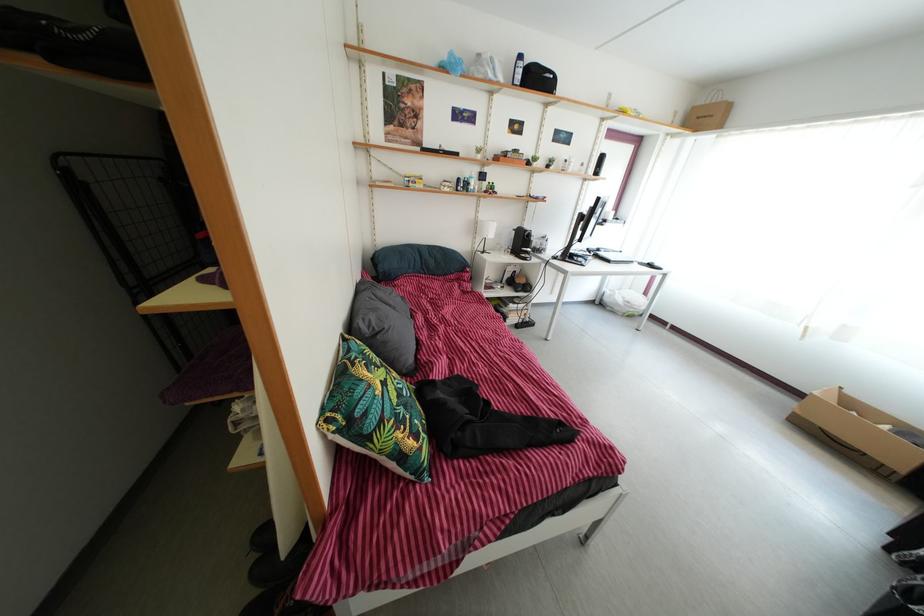
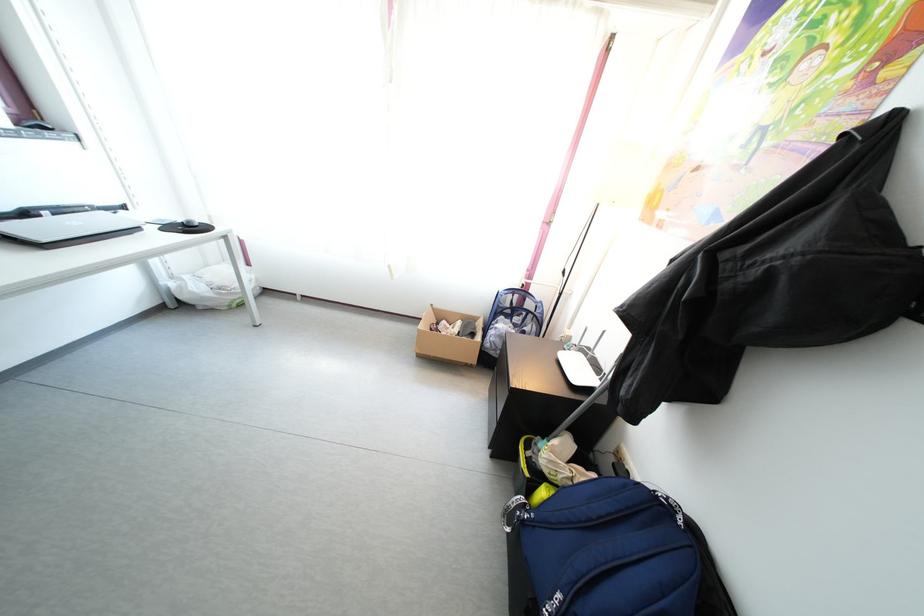
Find the pixel in the second image that matches point 624,312 in the first image.

(210, 306)